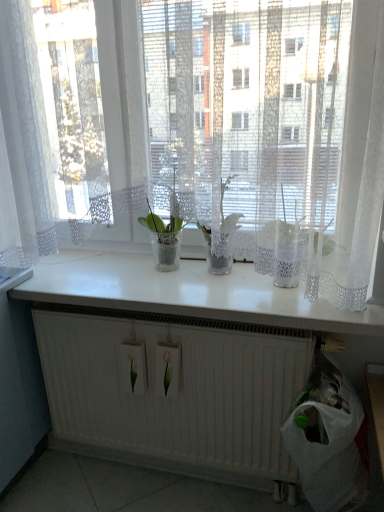
Find the location of a particular element. white lace curtain at upper center is located at coordinates (231, 135).

Image resolution: width=384 pixels, height=512 pixels. What do you see at coordinates (187, 292) in the screenshot?
I see `white glossy counter top at center` at bounding box center [187, 292].

Locate an element on the screen. The width and height of the screenshot is (384, 512). translucent glass vase at center is located at coordinates (165, 234).

In order to face white matte radiator at lower center, should I rotate leftwards or rightwards?

Rotate left and turn 1.937 degrees.

What is the approximate width of white plastic bag at lower right?

The width of white plastic bag at lower right is 11.70 inches.

Describe the element at coordinates (329, 441) in the screenshot. I see `white plastic bag at lower right` at that location.

Where is `white lace curtain at upper center`? The image size is (384, 512). white lace curtain at upper center is located at coordinates (231, 135).

Between translucent glass vase at center and translucent glass vase at center, which one has larger size?

Bigger between the two is translucent glass vase at center.

Considering the positions of objects translucent glass vase at center and translucent glass vase at center in the image provided, who is more to the left, translucent glass vase at center or translucent glass vase at center?

Positioned to the left is translucent glass vase at center.

Is translucent glass vase at center completely or partially inside translucent glass vase at center?

No.

Is translucent glass vase at center far from translucent glass vase at center?

translucent glass vase at center is actually quite close to translucent glass vase at center.

From a real-world perspective, between white lace curtain at upper center and white matte radiator at lower center, who is vertically lower?

In real-world perspective, white matte radiator at lower center is lower.

From the image's perspective, between white lace curtain at upper center and white matte radiator at lower center, which one is located above?

From the image's view, white lace curtain at upper center is above.

Where is `curtain in front of the white matte radiator at lower center`? This screenshot has width=384, height=512. curtain in front of the white matte radiator at lower center is located at coordinates (231, 135).

Is white lace curtain at upper center next to white matte radiator at lower center and touching it?

white lace curtain at upper center and white matte radiator at lower center are clearly separated.

From a real-world perspective, who is located lower, translucent glass vase at center or white matte radiator at lower center?

From a 3D spatial view, white matte radiator at lower center is below.

Does translucent glass vase at center come behind white matte radiator at lower center?

That is True.

What's the angular difference between translucent glass vase at center and white matte radiator at lower center's facing directions?

3.29 degrees.

Is translucent glass vase at center to the left of white matte radiator at lower center from the viewer's perspective?

Incorrect, translucent glass vase at center is not on the left side of white matte radiator at lower center.

Considering the positions of points (182, 218) and (362, 472), is point (182, 218) closer to camera compared to point (362, 472)?

No, (182, 218) is behind (362, 472).

Does translucent glass vase at center have a lesser width compared to white plastic bag at lower right?

Yes.

From a real-world perspective, is translucent glass vase at center below white plastic bag at lower right?

No, from a real-world perspective, translucent glass vase at center is not beneath white plastic bag at lower right.

Is translucent glass vase at center in front of white plastic bag at lower right?

No, translucent glass vase at center is further to the viewer.

From the image's perspective, is translucent glass vase at center positioned above or below translucent glass vase at center?

translucent glass vase at center is below translucent glass vase at center.

From a real-world perspective, between translucent glass vase at center and translucent glass vase at center, who is vertically higher?

translucent glass vase at center is physically above.

Do you think translucent glass vase at center is within translucent glass vase at center, or outside of it?

translucent glass vase at center is outside translucent glass vase at center.

Are translucent glass vase at center and translucent glass vase at center beside each other?

translucent glass vase at center is not next to translucent glass vase at center, and they're not touching.

Where is `radiator behind the white glossy counter top at center`? This screenshot has width=384, height=512. radiator behind the white glossy counter top at center is located at coordinates (175, 392).

Consider the image. Is white glossy counter top at center not within white matte radiator at lower center?

Yes.

Which is nearer, [328,303] or [67,374]?

The point [328,303] is closer.

Considering the relative sizes of white glossy counter top at center and white matte radiator at lower center in the image provided, is white glossy counter top at center thinner than white matte radiator at lower center?

Incorrect, the width of white glossy counter top at center is not less than that of white matte radiator at lower center.

Looking at this image, how many degrees apart are the facing directions of white matte radiator at lower center and translucent glass vase at center?

white matte radiator at lower center and translucent glass vase at center are facing 3.29 degrees away from each other.

From the image's perspective, is white matte radiator at lower center on translucent glass vase at center?

Actually, white matte radiator at lower center appears below translucent glass vase at center in the image.

Is white matte radiator at lower center not inside translucent glass vase at center?

white matte radiator at lower center is positioned outside translucent glass vase at center.

The image size is (384, 512). What are the coordinates of `radiator lying in front of the translucent glass vase at center` in the screenshot? It's located at (175, 392).

At what (x,y) coordinates should I click in order to perform the action: click on orchid above the translucent glass vase at center (from the image's perspective). Please return your answer as a coordinate pair (x, y). The height and width of the screenshot is (512, 384). Looking at the image, I should click on (229, 215).

Identify the location of radiator behind the white lace curtain at upper center. Image resolution: width=384 pixels, height=512 pixels. (175, 392).

Looking at the image, which one is located further to translucent glass vase at center, white glossy counter top at center or translucent glass vase at center?

Based on the image, white glossy counter top at center appears to be further to translucent glass vase at center.

Considering their positions, is white plastic bag at lower right positioned closer to translucent glass vase at center than white matte radiator at lower center?

white plastic bag at lower right is closer to translucent glass vase at center.

Estimate the real-world distances between objects in this image. Which object is closer to translucent glass vase at center, white lace curtain at upper center or white matte radiator at lower center?

white lace curtain at upper center is positioned closer to the anchor translucent glass vase at center.

Consider the image. Which object lies further to the anchor point white glossy counter top at center, white matte radiator at lower center or translucent glass vase at center?

The object further to white glossy counter top at center is white matte radiator at lower center.

Looking at this image, from the image, which object appears to be nearer to white plastic bag at lower right, white lace curtain at upper center or translucent glass vase at center?

white lace curtain at upper center is closer to white plastic bag at lower right.

Considering their positions, is white plastic bag at lower right positioned further to translucent glass vase at center than white matte radiator at lower center?

white plastic bag at lower right.

Which object lies further to the anchor point white plastic bag at lower right, translucent glass vase at center or white matte radiator at lower center?

translucent glass vase at center is positioned further to the anchor white plastic bag at lower right.

Based on their spatial positions, is white matte radiator at lower center or translucent glass vase at center further from translucent glass vase at center?

The object further to translucent glass vase at center is white matte radiator at lower center.

The height and width of the screenshot is (512, 384). What are the coordinates of `houseplant that lies between translucent glass vase at center and white plastic bag at lower right from top to bottom` in the screenshot? It's located at (165, 234).

At what (x,y) coordinates should I click in order to perform the action: click on counter top between white lace curtain at upper center and white plastic bag at lower right from top to bottom. Please return your answer as a coordinate pair (x, y). This screenshot has height=512, width=384. Looking at the image, I should click on (187, 292).

I want to click on orchid between white lace curtain at upper center and translucent glass vase at center from front to back, so click(x=229, y=215).

Locate an element on the screen. houseplant between white lace curtain at upper center and white plastic bag at lower right from top to bottom is located at coordinates (165, 234).